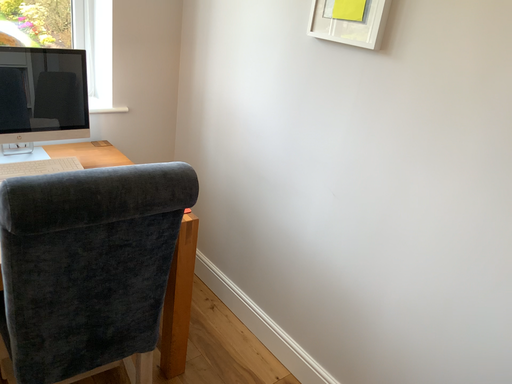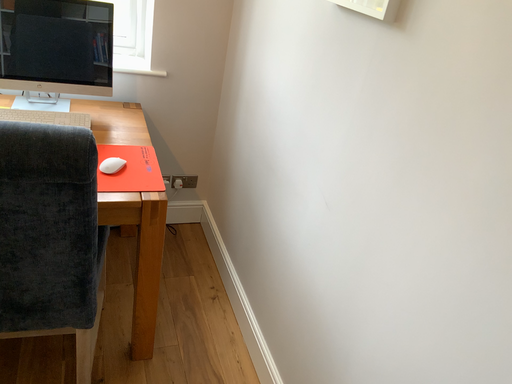
Question: How did the camera likely rotate when shooting the video?

Choices:
 (A) rotated right
 (B) rotated left

Answer: (B)